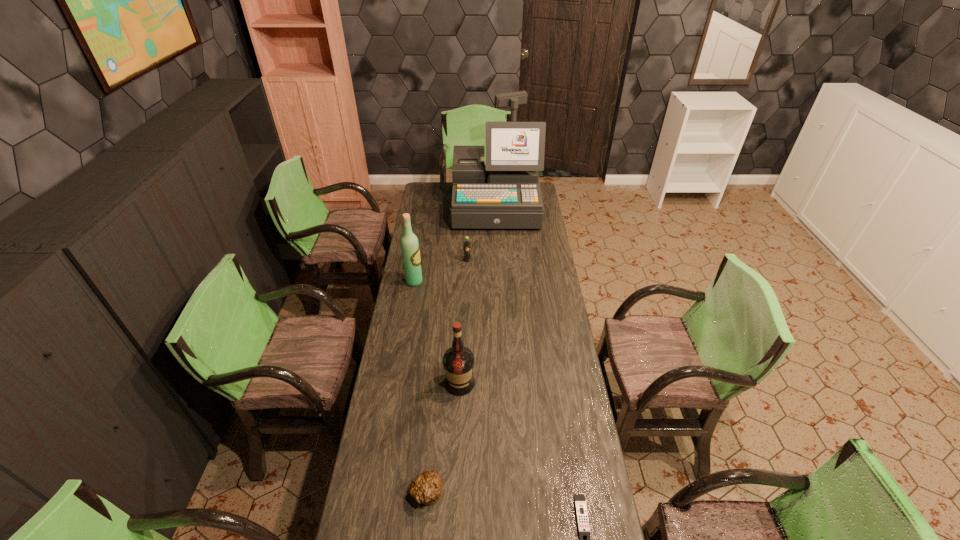
At what (x,y) coordinates should I click in order to perform the action: click on cash register. Please return your answer as a coordinate pair (x, y). This screenshot has width=960, height=540. Looking at the image, I should click on (505, 193).

Identify the location of the tallest object. (505, 193).

Where is `the fifth shortest object`? the fifth shortest object is located at coordinates 409,244.

Image resolution: width=960 pixels, height=540 pixels. Find the location of `wine bottle`. wine bottle is located at coordinates (409, 244).

You are a GUI agent. You are given a task and a screenshot of the screen. Output one action in this format:
    pyautogui.click(x=<x>, y=<y>)
    Task: Click on the liquor
    
    Given the screenshot: What is the action you would take?
    458,361

You are a GUI agent. You are given a task and a screenshot of the screen. Output one action in this format:
    pyautogui.click(x=<x>, y=<y>)
    Task: Click on the third nearest object
    The image size is (960, 540).
    Given the screenshot: What is the action you would take?
    pyautogui.click(x=458, y=361)

Identify the location of soda. (466, 244).

Identify the location of the fifth nearest object. This screenshot has height=540, width=960. (466, 244).

Where is `the second shortest object`? The width and height of the screenshot is (960, 540). the second shortest object is located at coordinates (426, 488).

This screenshot has height=540, width=960. I want to click on blank space located 0.090m on the customer-facing side of the tallest object, so click(497, 242).